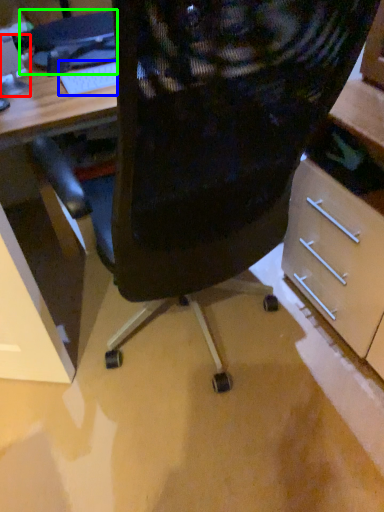
Question: Which object is positioned closest to computer monitor (highlighted by a red box)? Select from keyboard (highlighted by a blue box) and computer (highlighted by a green box).

Choices:
 (A) keyboard
 (B) computer

Answer: (B)